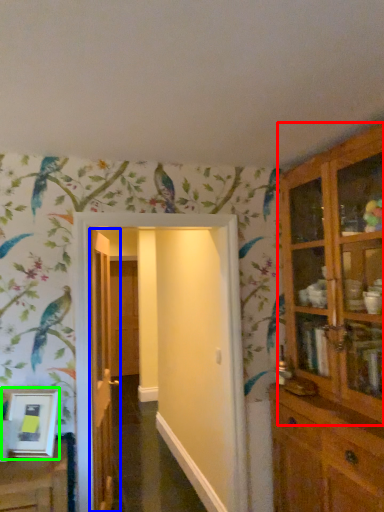
Question: Which object is positioned closest to cupboard (highlighted by a red box)? Select from door (highlighted by a blue box) and picture frame (highlighted by a green box).

Choices:
 (A) door
 (B) picture frame

Answer: (A)